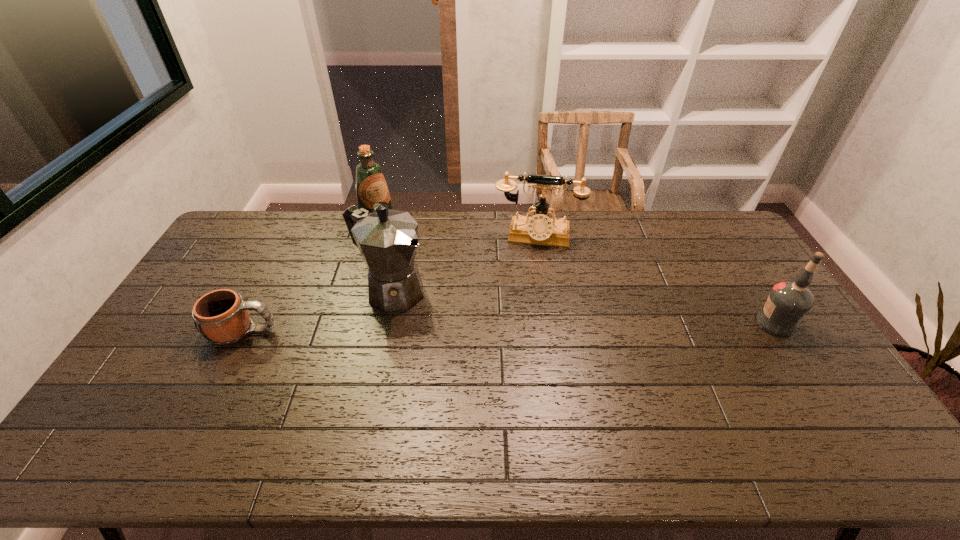
Locate an element on the screen. telephone situated at the far edge is located at coordinates (539, 229).

I want to click on object that is positioned at the left edge, so click(x=221, y=316).

The width and height of the screenshot is (960, 540). Identify the location of object positioned at the right edge. (788, 301).

Locate an element on the screen. This screenshot has width=960, height=540. vacant area at the far edge is located at coordinates (336, 219).

The width and height of the screenshot is (960, 540). Find the location of `vacant area at the near edge of the desktop`. vacant area at the near edge of the desktop is located at coordinates (408, 404).

In the image, there is a desktop. Where is `free space at the left edge`? Image resolution: width=960 pixels, height=540 pixels. free space at the left edge is located at coordinates (224, 289).

I want to click on vacant area at the far left corner of the desktop, so click(264, 225).

The image size is (960, 540). What are the coordinates of `free space between the rightmost object and the shortest object` in the screenshot? It's located at (510, 327).

Locate an element on the screen. This screenshot has height=540, width=960. free space between the fourth object from left to right and the coffeepot is located at coordinates click(464, 264).

Where is `vacant area that lies between the rightmost object and the fourth object from left to right`? This screenshot has width=960, height=540. vacant area that lies between the rightmost object and the fourth object from left to right is located at coordinates 656,279.